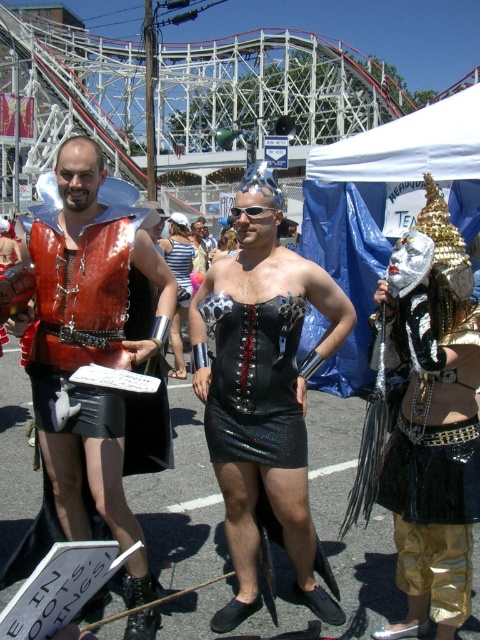
Looking at this image, you are at a festival and want to take a photo with both the shiny leather vest at center and the metallic silver dress at center. Can you fit both in the frame if your camera has a 1.5 meter wide field of view?

The shiny leather vest at center is wider than the metallic silver dress at center. Since the camera has a 1.5 meter wide field of view, you need to ensure both items fit within that width. However, without knowing their exact widths, it is uncertain if they will fit together. You might need to adjust their positions or zoom out slightly to include both.

You are a photographer at the festival and want to capture a photo of the shiny black dress at center and the metallic silver dress at center. Which dress should you focus on if you want to highlight the shorter one?

The shiny black dress at center is shorter than the metallic silver dress at center, so you should focus on the shiny black dress at center to highlight the shorter one.

You are standing in the festival area near the roller coaster and want to take a photo that includes both the point at coordinates point (73, 460) and point (194, 308). Which point should you focus on first to ensure both are in focus?

You should focus on point (73, 460) first because it is closer to you than point (194, 308), so adjusting focus from near to far will help both points be in focus.